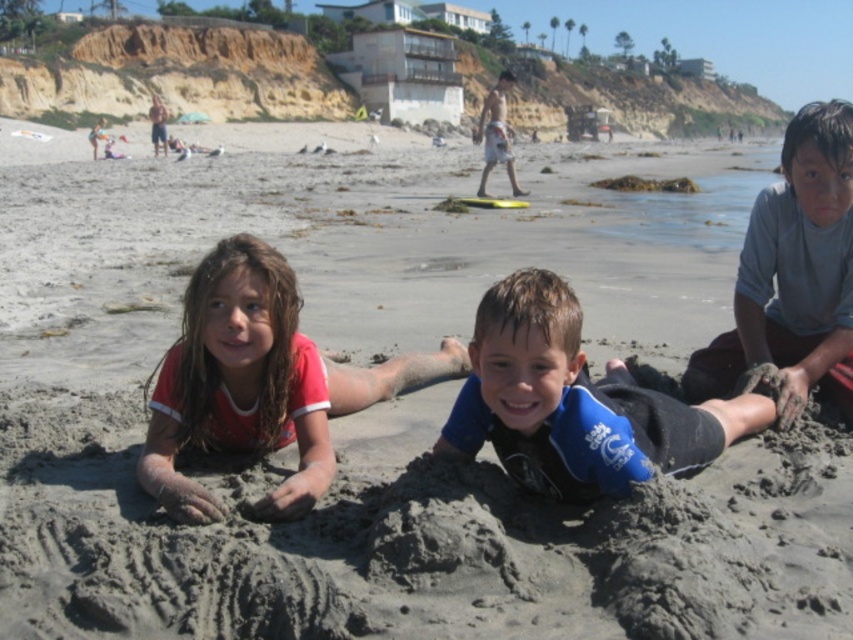
Question: Which point appears closest to the camera in this image?

Choices:
 (A) (242, 259)
 (B) (630, 445)
 (C) (836, 298)

Answer: (B)

Question: Does wet red shirt at center lie in front of gray matte shirt at center?

Choices:
 (A) yes
 (B) no

Answer: (A)

Question: Which of the following is the farthest from the observer?

Choices:
 (A) blue fabric at center
 (B) wet red shirt at center
 (C) gray matte shirt at center

Answer: (C)

Question: Does wet red shirt at center have a greater width compared to gray matte shirt at center?

Choices:
 (A) yes
 (B) no

Answer: (B)

Question: Which point appears closest to the camera in this image?

Choices:
 (A) (520, 305)
 (B) (198, 324)

Answer: (A)

Question: Where is wet red shirt at center located in relation to blue fabric at center in the image?

Choices:
 (A) left
 (B) right

Answer: (A)